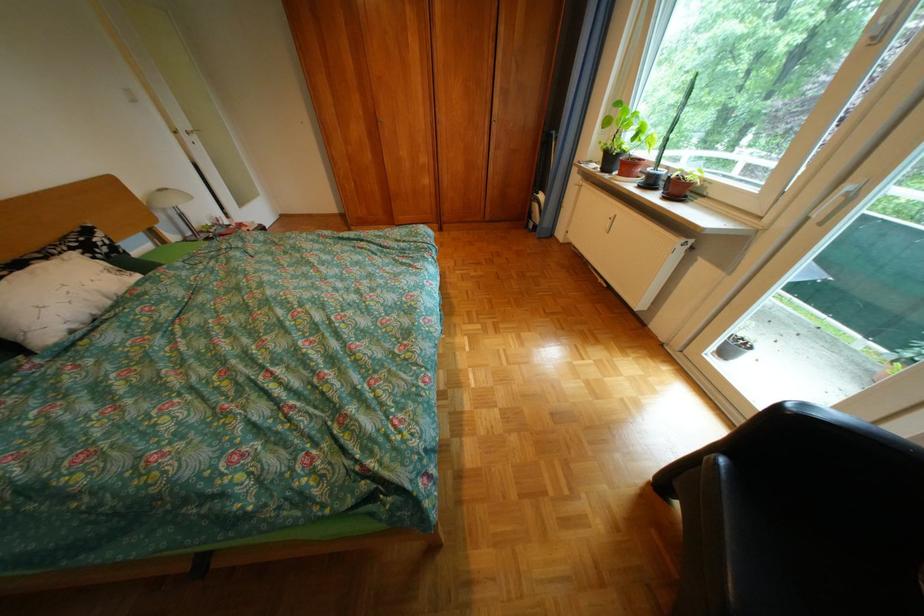
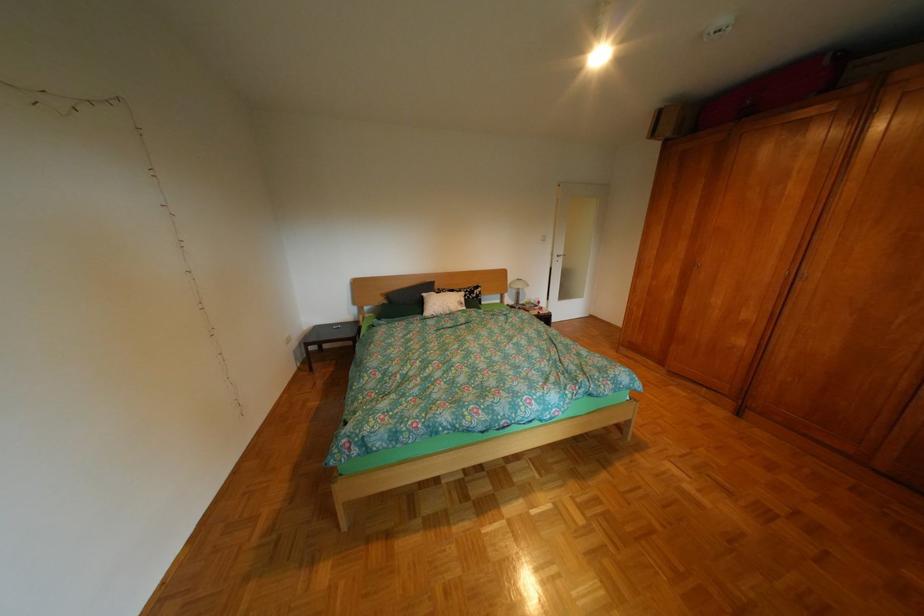
Find the pixel in the second image that matches (453,118) in the first image.

(819, 273)